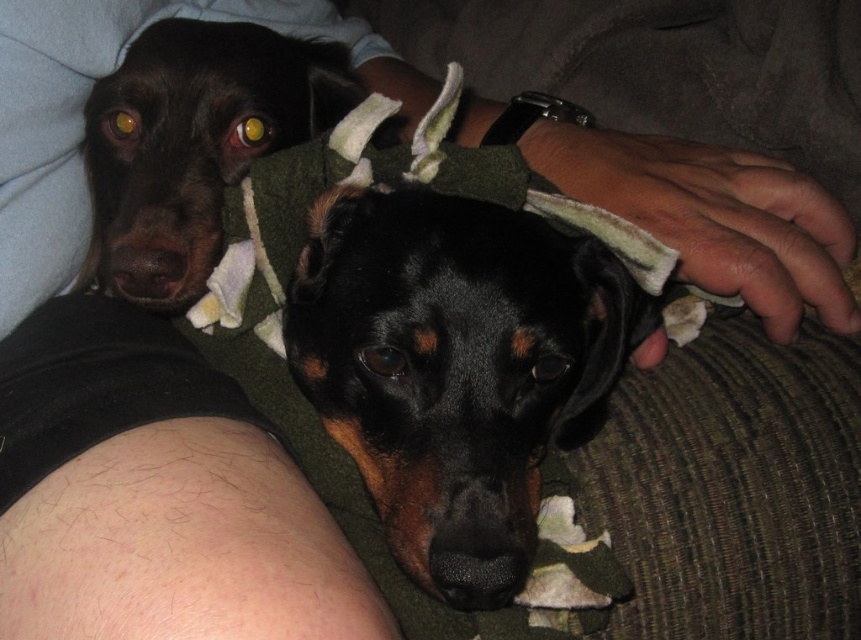
Question: Can you confirm if black matte dog at center is positioned below shiny black dog at upper left?

Choices:
 (A) no
 (B) yes

Answer: (B)

Question: Can you confirm if black matte dog at center is wider than shiny black dog at upper left?

Choices:
 (A) no
 (B) yes

Answer: (B)

Question: Does black matte dog at center appear on the left side of shiny black dog at upper left?

Choices:
 (A) no
 (B) yes

Answer: (A)